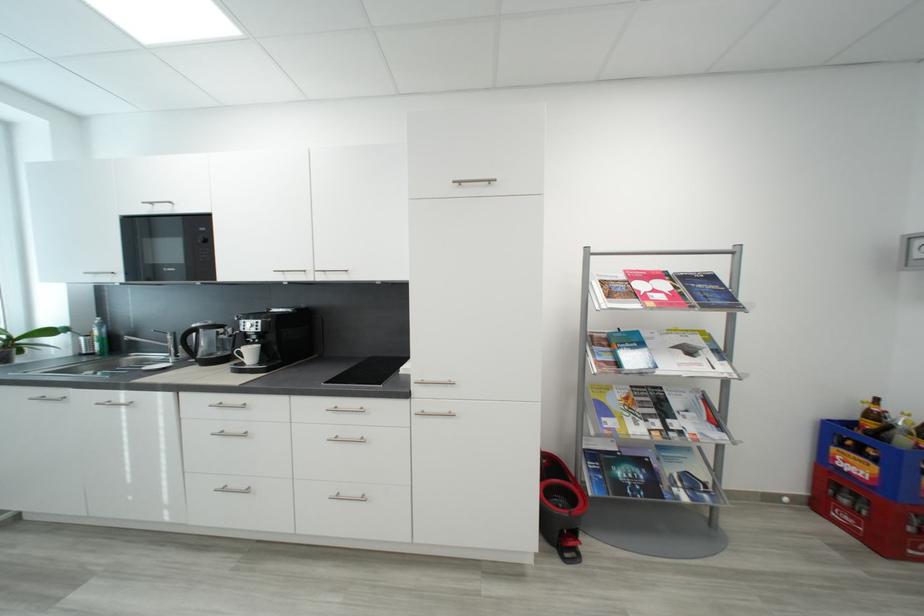
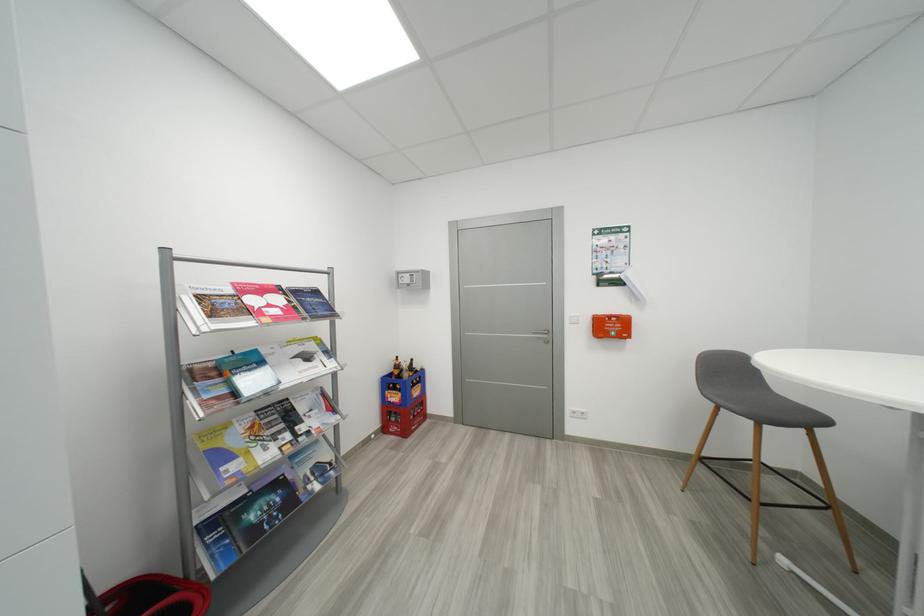
Find the pixel in the second image that matches point 650,464 in the first image.

(285, 485)